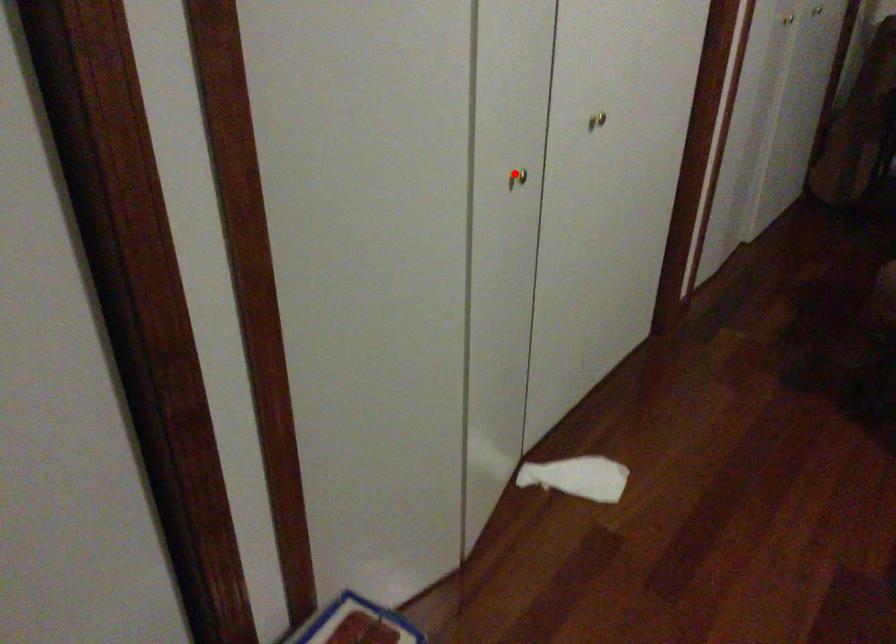
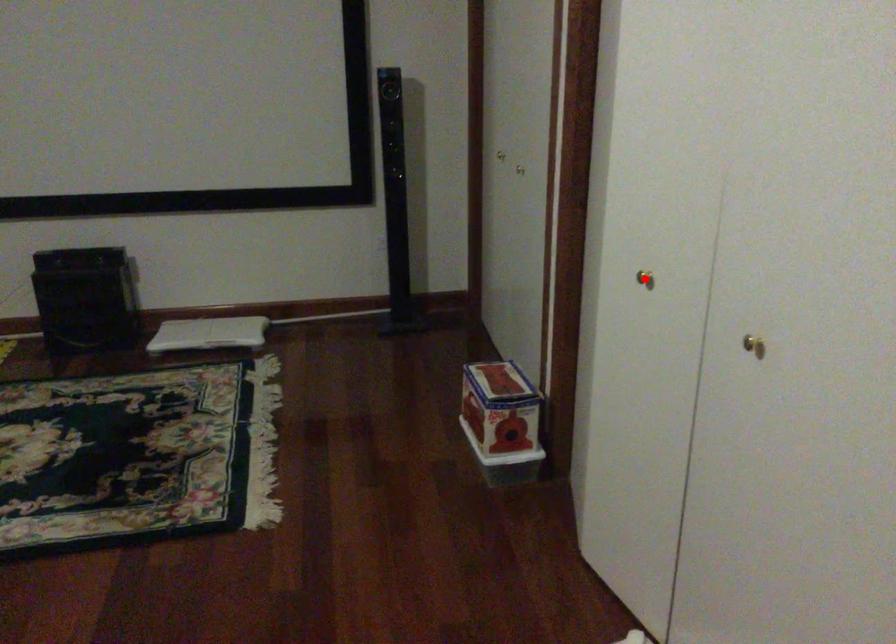
I am providing you with two images of the same scene from different viewpoints. A red point is marked on the first image and another point is marked on the second image. Is the red point in image1 aligned with the point shown in image2?

Yes